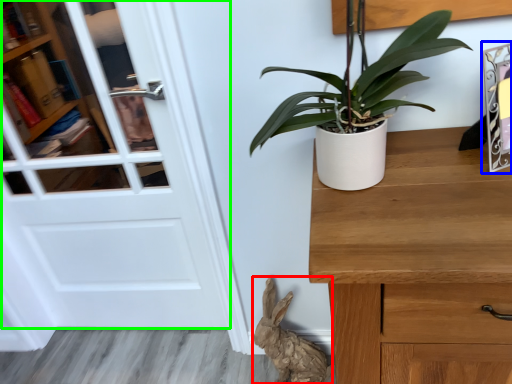
Question: Based on their relative distances, which object is nearer to animal (highlighted by a red box)? Choose from picture frame (highlighted by a blue box) and door (highlighted by a green box).

Choices:
 (A) picture frame
 (B) door

Answer: (B)